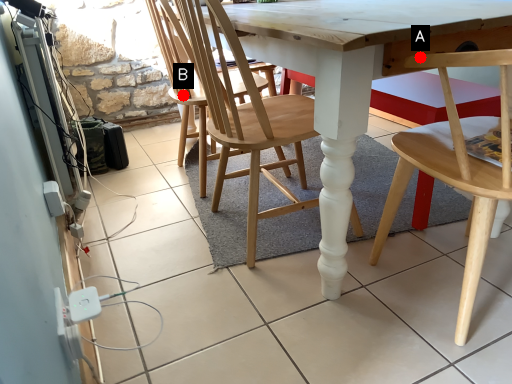
Question: Two points are circled on the image, labeled by A and B beside each circle. Which point appears farthest from the camera in this image?

Choices:
 (A) A is further
 (B) B is further

Answer: (B)